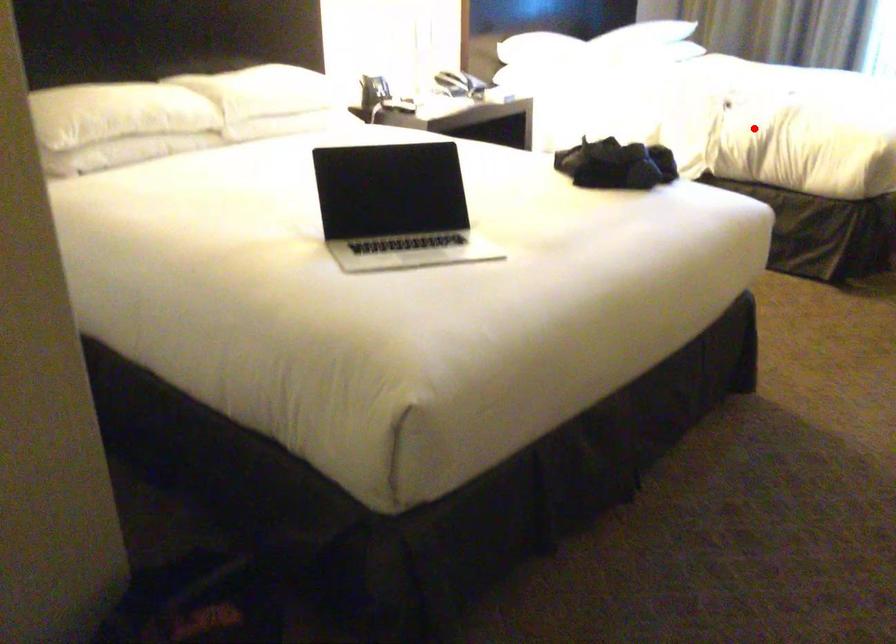
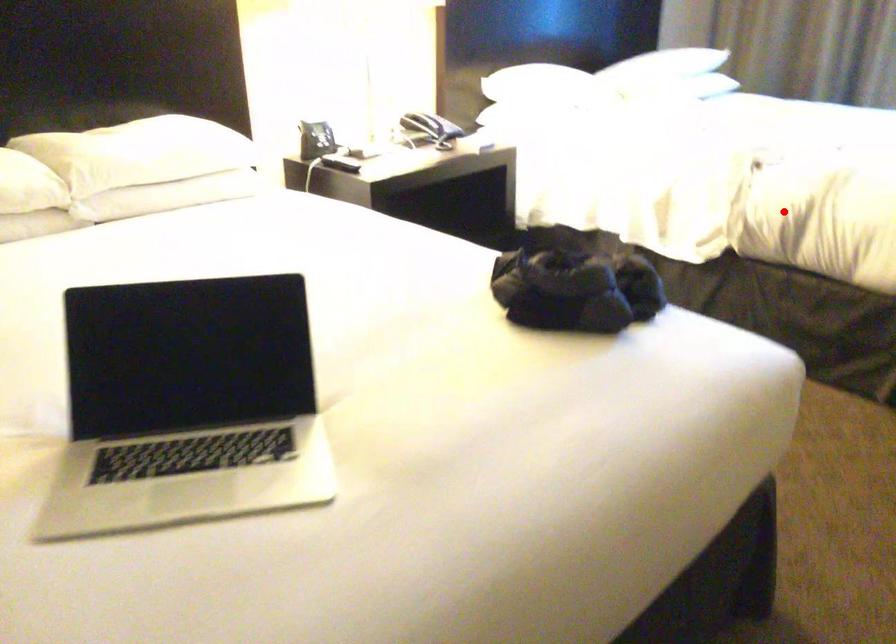
I am providing you with two images of the same scene from different viewpoints. A red point is marked on the first image and another point is marked on the second image. Do the highlighted points in image1 and image2 indicate the same real-world spot?

Yes